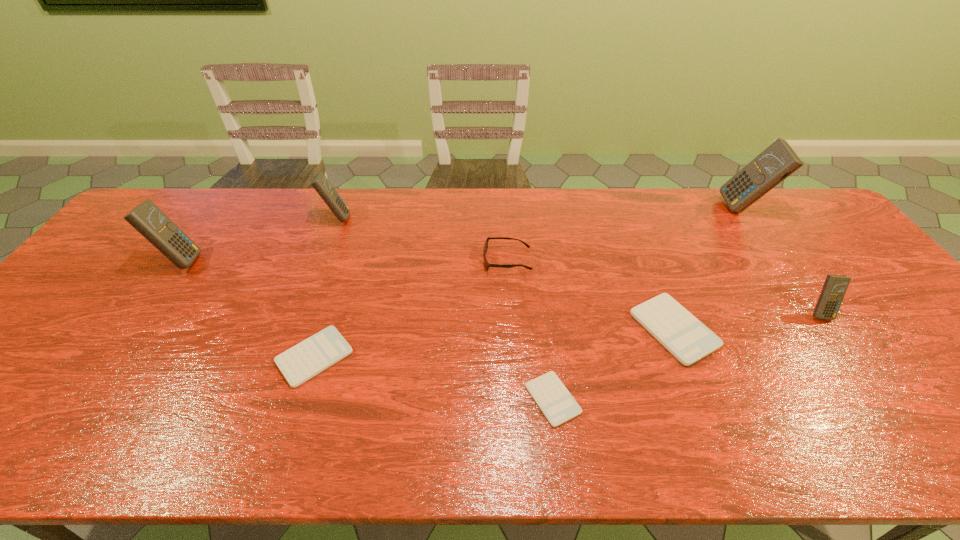
Find the location of `vacant position located on the front-facing side of the nearest blue calculator`. vacant position located on the front-facing side of the nearest blue calculator is located at coordinates (866, 377).

Where is `vacant space situated on the front-facing side of the sunglasses`? This screenshot has width=960, height=540. vacant space situated on the front-facing side of the sunglasses is located at coordinates (439, 260).

At what (x,y) coordinates should I click in order to perform the action: click on free space located on the front-facing side of the sunglasses. Please return your answer as a coordinate pair (x, y). Image resolution: width=960 pixels, height=540 pixels. Looking at the image, I should click on (392, 260).

Where is `vacant space located 0.250m on the front-facing side of the sunglasses`? Image resolution: width=960 pixels, height=540 pixels. vacant space located 0.250m on the front-facing side of the sunglasses is located at coordinates (398, 260).

Locate an element on the screen. vacant space located 0.240m on the right of the rightmost white calculator is located at coordinates (809, 329).

This screenshot has height=540, width=960. I want to click on free space located 0.330m on the left of the second shortest calculator, so click(x=138, y=357).

Where is `vacant region located on the right of the shortest calculator`? vacant region located on the right of the shortest calculator is located at coordinates (730, 399).

This screenshot has width=960, height=540. I want to click on object located in the near edge section of the desktop, so click(x=557, y=404).

At what (x,y) coordinates should I click in order to perform the action: click on object that is at the right edge. Please return your answer as a coordinate pair (x, y). The image size is (960, 540). Looking at the image, I should click on (778, 161).

The image size is (960, 540). Find the location of `object that is at the far right corner`. object that is at the far right corner is located at coordinates (778, 161).